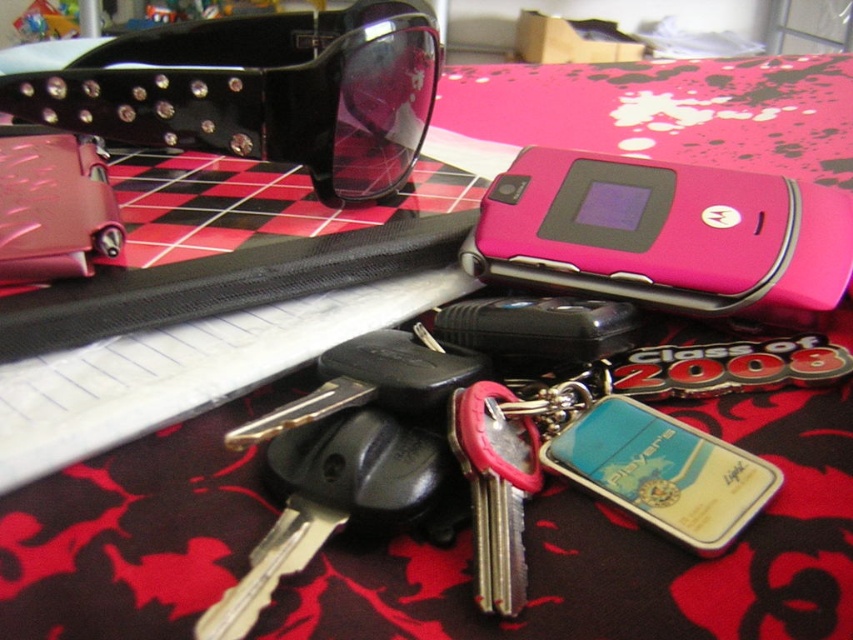
Question: Is pink plastic motorola phone at center bigger than metallic silver key at center?

Choices:
 (A) yes
 (B) no

Answer: (A)

Question: Does black shiny sunglasses at upper left appear on the right side of pink plastic motorola phone at center?

Choices:
 (A) yes
 (B) no

Answer: (B)

Question: Can you confirm if black shiny sunglasses at upper left is bigger than pink plastic motorola phone at center?

Choices:
 (A) no
 (B) yes

Answer: (B)

Question: Which of the following is the closest to the observer?

Choices:
 (A) black shiny sunglasses at upper left
 (B) pink plastic motorola phone at center
 (C) metallic silver key at center

Answer: (C)

Question: Among these points, which one is nearest to the camera?

Choices:
 (A) (274, 129)
 (B) (819, 198)
 (C) (480, 557)

Answer: (C)

Question: Which point is farther to the camera?

Choices:
 (A) click(x=486, y=566)
 (B) click(x=799, y=180)

Answer: (B)